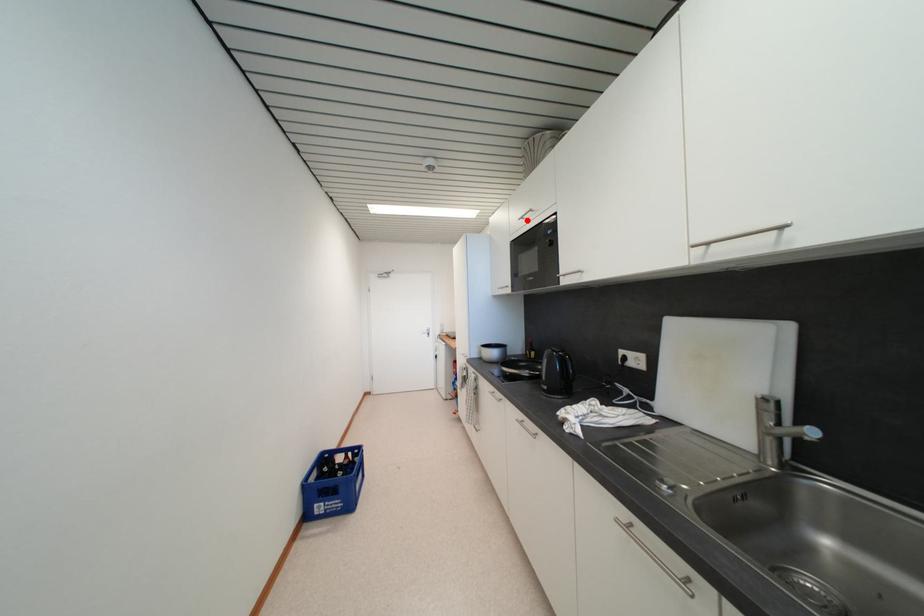
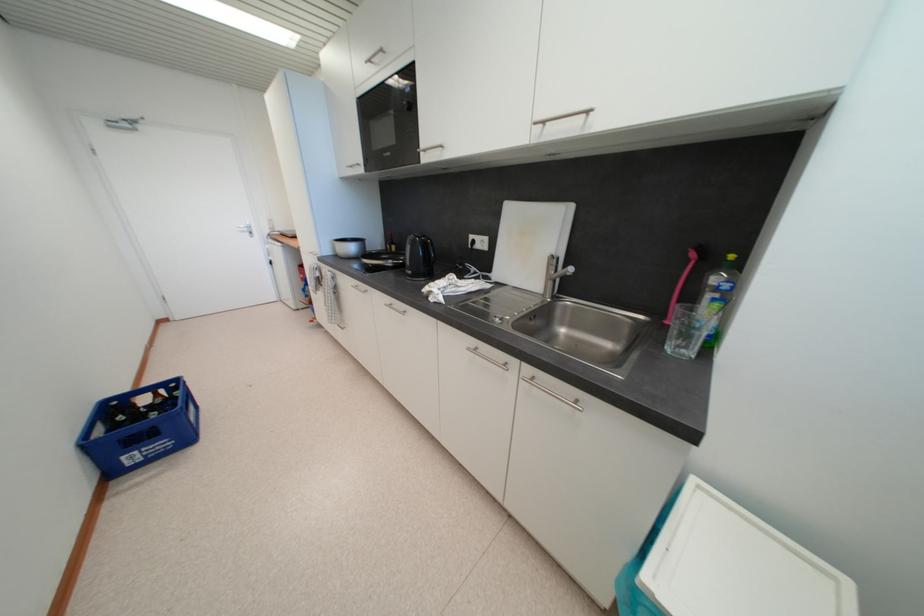
Question: A red point is marked in image1. In image2, is the corresponding 3D point closer to the camera or farther? Reply with the corresponding letter.

Choices:
 (A) The corresponding 3D point is closer.
 (B) The corresponding 3D point is farther.

Answer: (B)